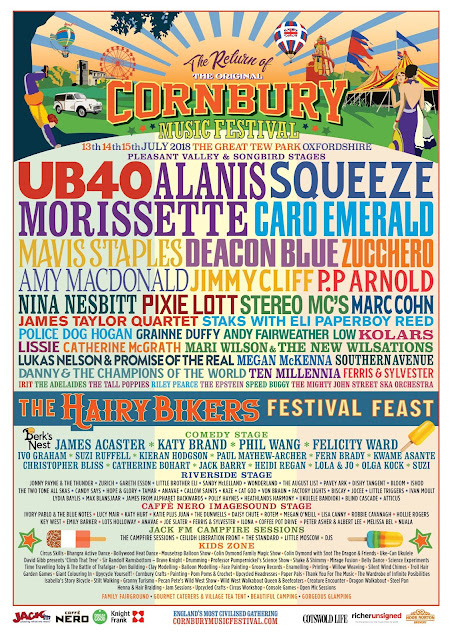
The height and width of the screenshot is (640, 452). I want to click on mirror, so click(70, 96), click(61, 96), click(76, 96).